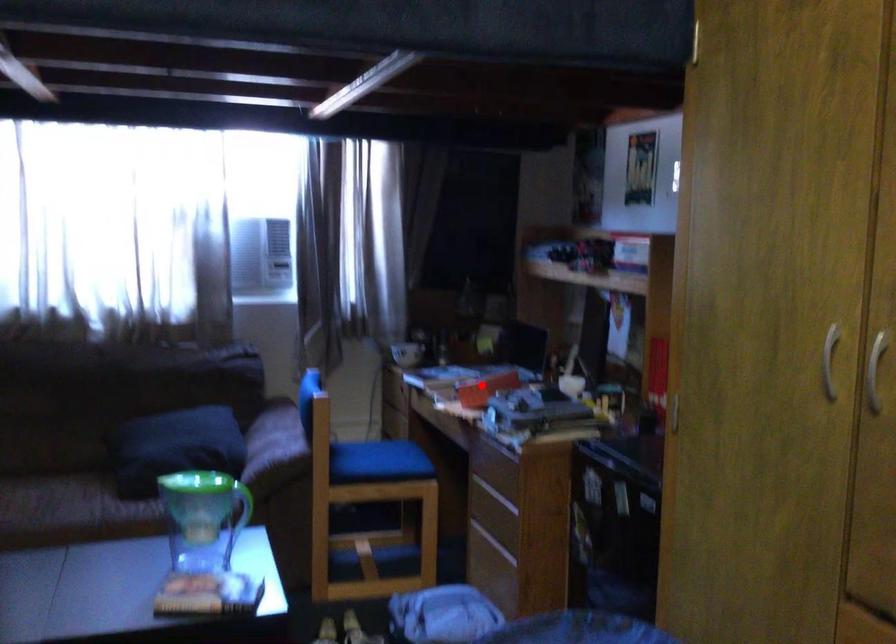
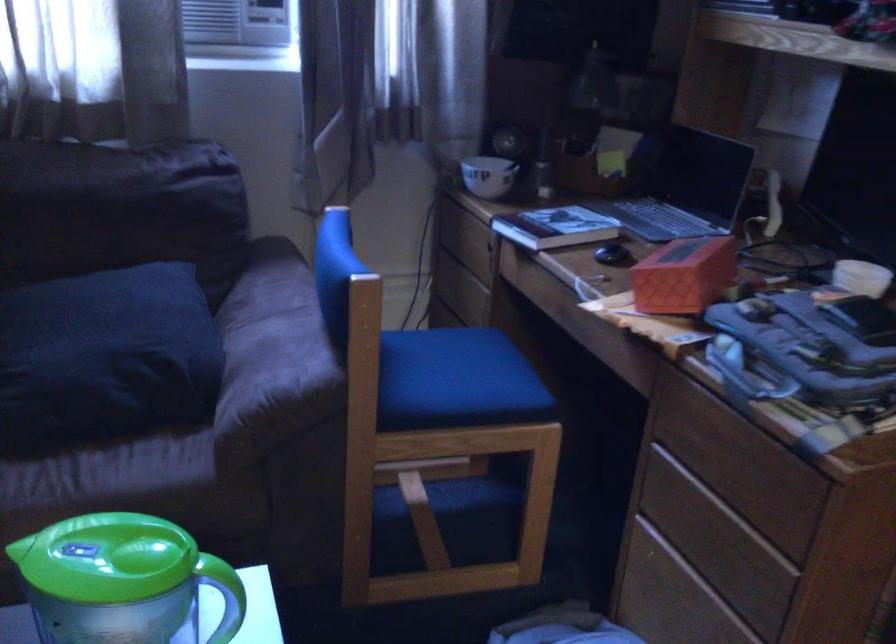
Question: I am providing you with two images of the same scene from different viewpoints. A red point is shown in image1. For the corresponding object point in image2, is it positioned nearer or farther from the camera?

Choices:
 (A) Nearer
 (B) Farther

Answer: (A)